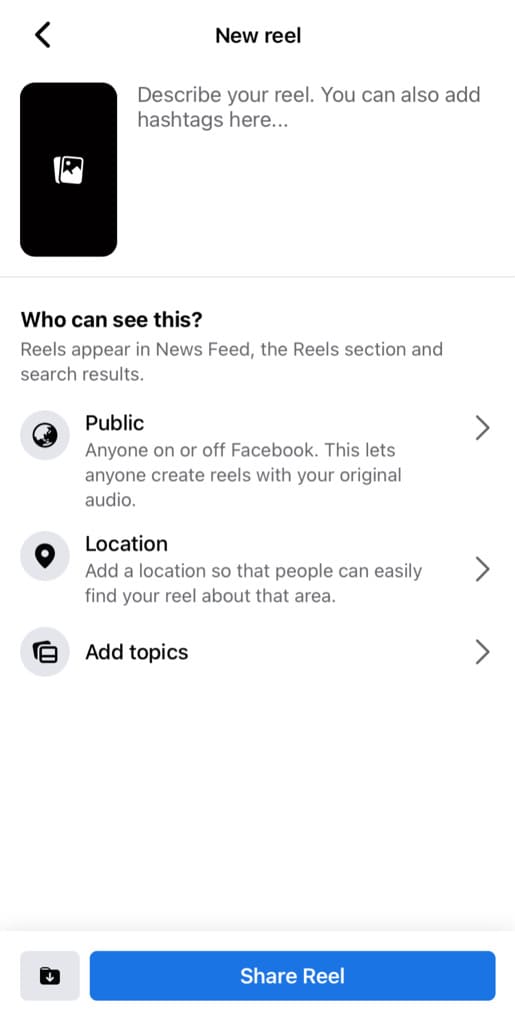
Find the location of a particular element. The height and width of the screenshot is (1023, 515). writing box is located at coordinates (207, 116).